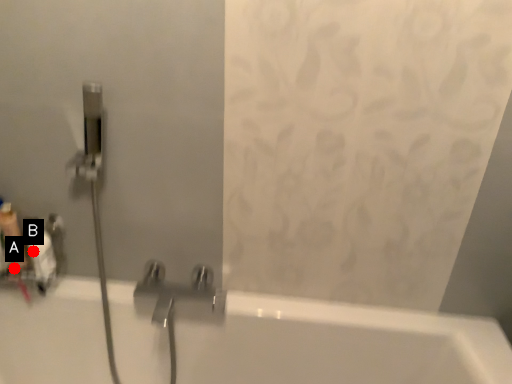
Question: Two points are circled on the image, labeled by A and B beside each circle. Which point appears closest to the camera in this image?

Choices:
 (A) A is closer
 (B) B is closer

Answer: (B)